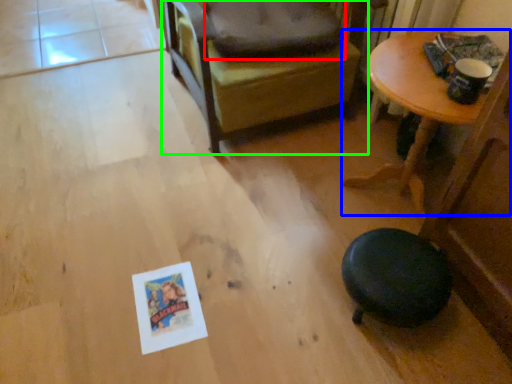
Question: Based on their relative distances, which object is farther from dog bed (highlighted by a red box)? Choose from table (highlighted by a blue box) and chair (highlighted by a green box).

Choices:
 (A) table
 (B) chair

Answer: (A)